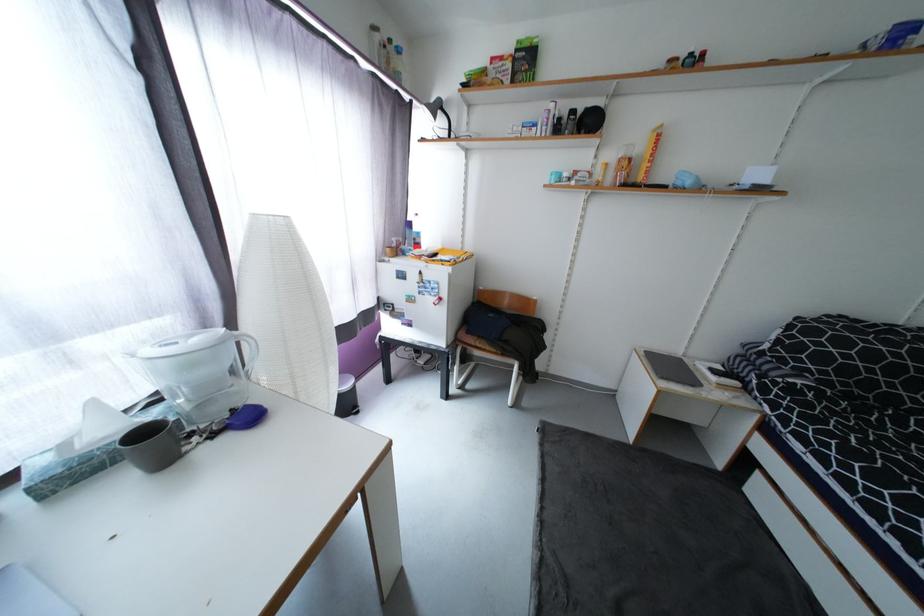
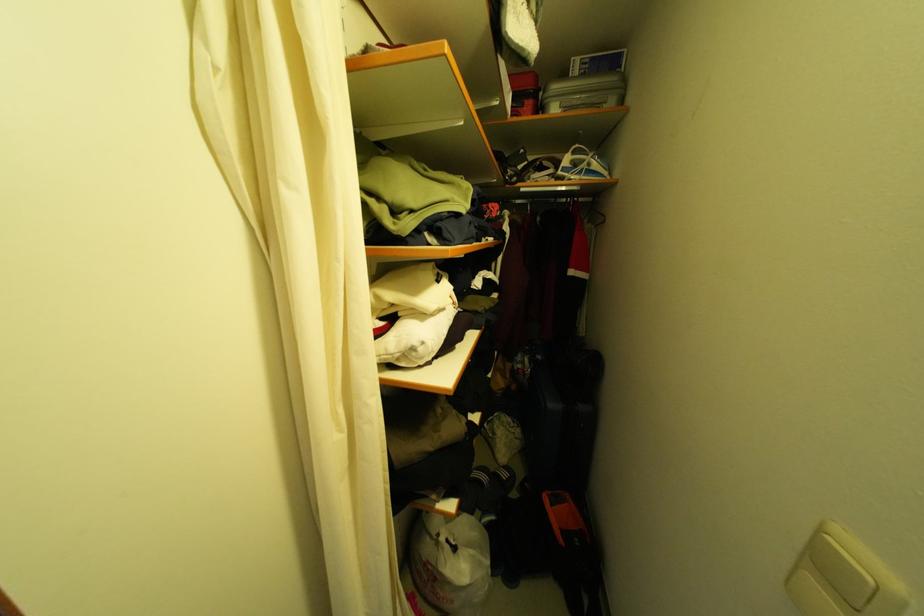
From the picture: Which direction would the cameraman need to move to produce the second image?

The cameraman moved toward right, backward.